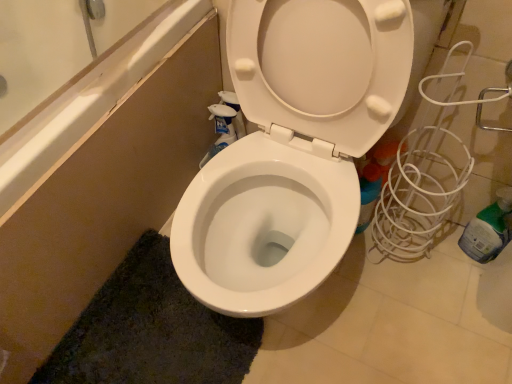
Question: Is green plastic bottle at right to the left or to the right of dark green shaggy bath mat at lower left in the image?

Choices:
 (A) right
 (B) left

Answer: (A)

Question: Considering the positions of green plastic bottle at right and dark green shaggy bath mat at lower left in the image, is green plastic bottle at right taller or shorter than dark green shaggy bath mat at lower left?

Choices:
 (A) tall
 (B) short

Answer: (A)

Question: Relative to dark green shaggy bath mat at lower left, is green plastic bottle at right in front or behind?

Choices:
 (A) behind
 (B) front

Answer: (A)

Question: In the image, is dark green shaggy bath mat at lower left positioned in front of or behind green plastic bottle at right?

Choices:
 (A) front
 (B) behind

Answer: (A)

Question: From the image's perspective, is dark green shaggy bath mat at lower left located above or below green plastic bottle at right?

Choices:
 (A) above
 (B) below

Answer: (B)

Question: From a real-world perspective, is dark green shaggy bath mat at lower left physically located above or below green plastic bottle at right?

Choices:
 (A) below
 (B) above

Answer: (A)

Question: Based on their sizes in the image, would you say dark green shaggy bath mat at lower left is bigger or smaller than green plastic bottle at right?

Choices:
 (A) big
 (B) small

Answer: (A)